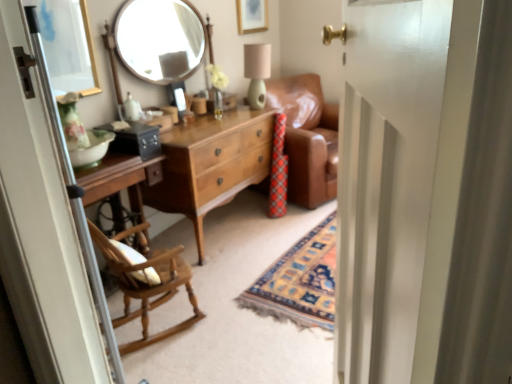
Where is `vacant space to the left of matte green lampshade at upper center`? vacant space to the left of matte green lampshade at upper center is located at coordinates (232, 110).